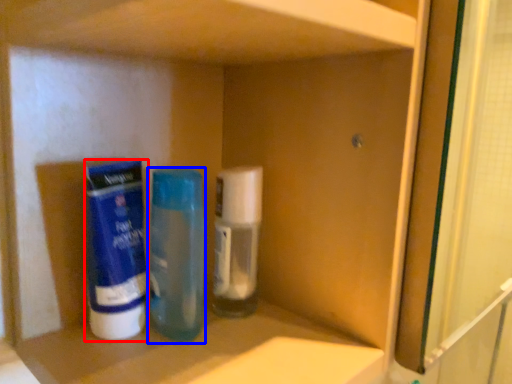
Question: Among these objects, which one is nearest to the camera, cleaning product (highlighted by a red box) or bottle (highlighted by a blue box)?

Choices:
 (A) cleaning product
 (B) bottle

Answer: (A)